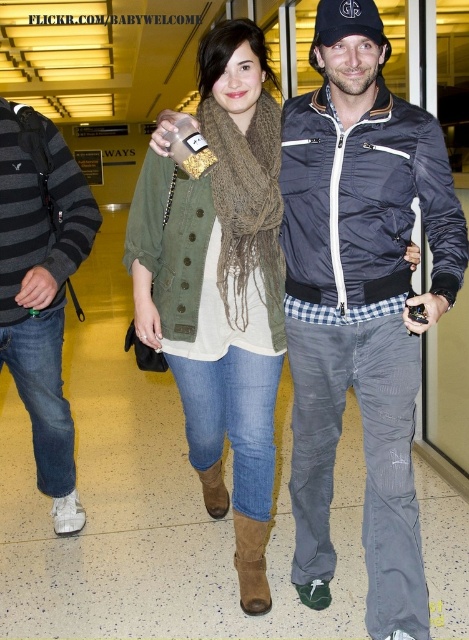
Question: Does striped knit sweater at left have a smaller size compared to black cap at upper center?

Choices:
 (A) yes
 (B) no

Answer: (B)

Question: Which object is farther from the camera taking this photo?

Choices:
 (A) brown knitted scarf at center
 (B) striped knit sweater at left
 (C) matte blue bomber jacket at center
 (D) black cap at upper center

Answer: (B)

Question: Is brown knitted scarf at center wider than black cap at upper center?

Choices:
 (A) yes
 (B) no

Answer: (A)

Question: Considering the relative positions of striped knit sweater at left and black cap at upper center in the image provided, where is striped knit sweater at left located with respect to black cap at upper center?

Choices:
 (A) right
 (B) left

Answer: (B)

Question: Which of these objects is positioned closest to the black cap at upper center?

Choices:
 (A) striped knit sweater at left
 (B) matte blue bomber jacket at center

Answer: (B)

Question: Which point is closer to the camera taking this photo?

Choices:
 (A) (393, 150)
 (B) (45, 161)
 (C) (370, 29)
 (D) (236, 522)

Answer: (C)